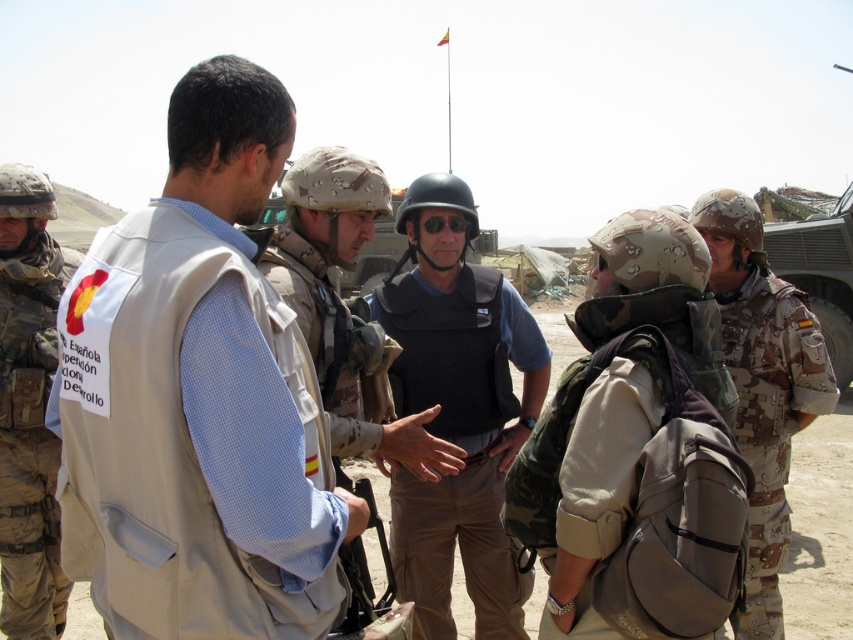
Does camo fabric backpack at center appear over light beige vest at center?

Actually, camo fabric backpack at center is below light beige vest at center.

Does camo fabric backpack at center have a larger size compared to light beige vest at center?

Actually, camo fabric backpack at center might be smaller than light beige vest at center.

Which is in front, point (569, 534) or point (355, 438)?

Positioned in front is point (569, 534).

Where is `camo fabric backpack at center`? This screenshot has width=853, height=640. camo fabric backpack at center is located at coordinates (637, 451).

Who is lower down, black matte vest at center or camouflage fabric helmet at left?

black matte vest at center is below.

Who is higher up, black matte vest at center or camouflage fabric helmet at left?

camouflage fabric helmet at left

Between point (396, 264) and point (22, 435), which one is positioned in front?

Point (22, 435)

Locate an element on the screen. Image resolution: width=853 pixels, height=640 pixels. black matte vest at center is located at coordinates (457, 412).

Who is taller, beige fabric vest at center or camouflage fabric helmet at right?

camouflage fabric helmet at right

Can you confirm if beige fabric vest at center is positioned to the left of camouflage fabric helmet at right?

Yes, beige fabric vest at center is to the left of camouflage fabric helmet at right.

Is point (294, 516) positioned before point (722, 250)?

That is True.

Where is `beige fabric vest at center`? This screenshot has height=640, width=853. beige fabric vest at center is located at coordinates (198, 397).